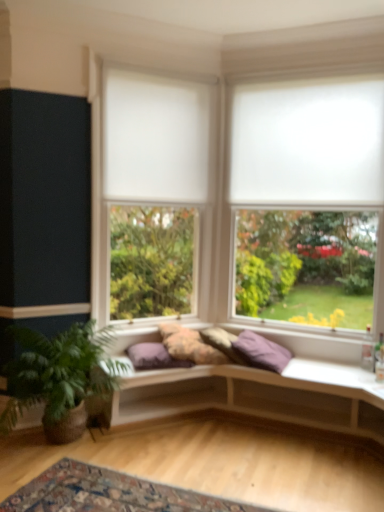
The image size is (384, 512). Find the location of `vacant area situated below wooden studio couch at center (from a real-world perspective)`. vacant area situated below wooden studio couch at center (from a real-world perspective) is located at coordinates (238, 444).